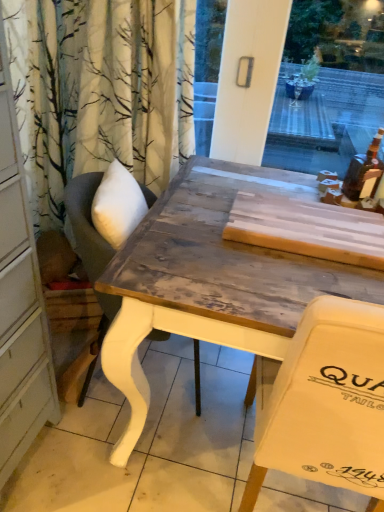
Identify the location of wooden chair at center. (87, 224).

What do you see at coordinates (87, 224) in the screenshot? This screenshot has width=384, height=512. I see `wooden chair at center` at bounding box center [87, 224].

Looking at this image, what is the approximate height of wooden table at center?

The height of wooden table at center is 97.14 centimeters.

Image resolution: width=384 pixels, height=512 pixels. Identify the location of wooden chair at center. (87, 224).

Can you confirm if translucent amber bottle at upper right is thinner than wooden chair at center?

Yes.

Does translucent amber bottle at upper right come in front of wooden chair at center?

No, translucent amber bottle at upper right is further to the viewer.

Is translucent amber bottle at upper right aimed at wooden chair at center?

No, translucent amber bottle at upper right is not facing towards wooden chair at center.

Between translucent amber bottle at upper right and wooden table at center, which one appears on the right side from the viewer's perspective?

Positioned to the right is translucent amber bottle at upper right.

Is translucent amber bottle at upper right positioned with its back to wooden table at center?

No, wooden table at center is not at the back of translucent amber bottle at upper right.

Considering the sizes of objects translucent amber bottle at upper right and wooden table at center in the image provided, who is smaller, translucent amber bottle at upper right or wooden table at center?

With smaller size is translucent amber bottle at upper right.

Which is closer to the camera, (x=357, y=180) or (x=274, y=332)?

Point (x=357, y=180) appears to be farther away from the viewer than point (x=274, y=332).

Considering the sizes of objects wooden chair at center and wooden table at center in the image provided, who is taller, wooden chair at center or wooden table at center?

Standing taller between the two is wooden table at center.

Would you say wooden chair at center is a long distance from wooden table at center?

No.

This screenshot has width=384, height=512. Find the location of `table in front of the wooden chair at center`. table in front of the wooden chair at center is located at coordinates (211, 279).

How different are the orientations of wooden chair at center and wooden table at center in degrees?

wooden chair at center and wooden table at center are facing 90 degrees away from each other.

From a real-world perspective, is wooden table at center above or below translucent amber bottle at upper right?

In terms of real-world spatial position, wooden table at center is below translucent amber bottle at upper right.

Is wooden table at center further to the viewer compared to translucent amber bottle at upper right?

No, wooden table at center is closer to the viewer.

Is wooden chair at center directly adjacent to translucent amber bottle at upper right?

They are not placed beside each other.

Is wooden chair at center to the left of translucent amber bottle at upper right from the viewer's perspective?

Yes, wooden chair at center is to the left of translucent amber bottle at upper right.

Between wooden chair at center and translucent amber bottle at upper right, which one has smaller size?

Smaller between the two is translucent amber bottle at upper right.

Is wooden table at center far away from wooden chair at center?

They are positioned close to each other.

Does wooden table at center have a greater height compared to wooden chair at center?

Correct, wooden table at center is much taller as wooden chair at center.

Based on the photo, from the image's perspective, who appears lower, wooden table at center or wooden chair at center?

wooden table at center.

Is wooden table at center turned away from wooden chair at center?

wooden table at center is not turned away from wooden chair at center.

Where is `alcohol lying behind the wooden chair at center`? The width and height of the screenshot is (384, 512). alcohol lying behind the wooden chair at center is located at coordinates (364, 172).

Find the location of a particular element. This screenshot has width=384, height=512. alcohol above the wooden table at center (from a real-world perspective) is located at coordinates 364,172.

Which object lies further to the anchor point translucent amber bottle at upper right, wooden chair at center or wooden table at center?

The object further to translucent amber bottle at upper right is wooden chair at center.

Based on the photo, which object lies nearer to the anchor point wooden chair at center, wooden table at center or translucent amber bottle at upper right?

wooden table at center.

From the image, which object appears to be nearer to wooden table at center, translucent amber bottle at upper right or wooden chair at center?

Answer: Among the two, wooden chair at center is located nearer to wooden table at center.

Which object lies further to the anchor point translucent amber bottle at upper right, wooden table at center or wooden chair at center?

wooden chair at center lies further to translucent amber bottle at upper right than the other object.

From the image, which object appears to be farther from wooden chair at center, translucent amber bottle at upper right or wooden table at center?

The object further to wooden chair at center is translucent amber bottle at upper right.

Which object lies nearer to the anchor point wooden table at center, wooden chair at center or translucent amber bottle at upper right?

wooden chair at center is positioned closer to the anchor wooden table at center.

Where is `table between wooden chair at center and translucent amber bottle at upper right from left to right`? table between wooden chair at center and translucent amber bottle at upper right from left to right is located at coordinates (211, 279).